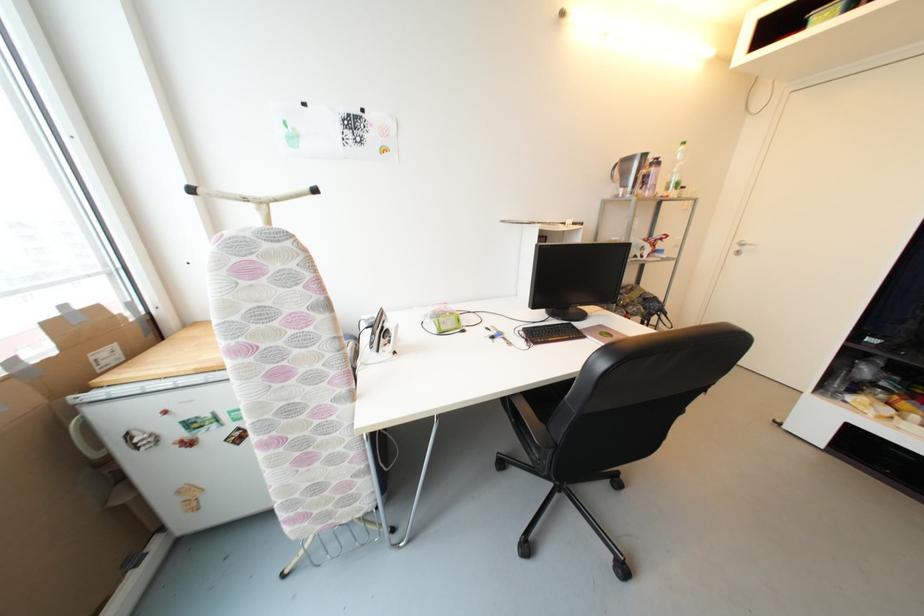
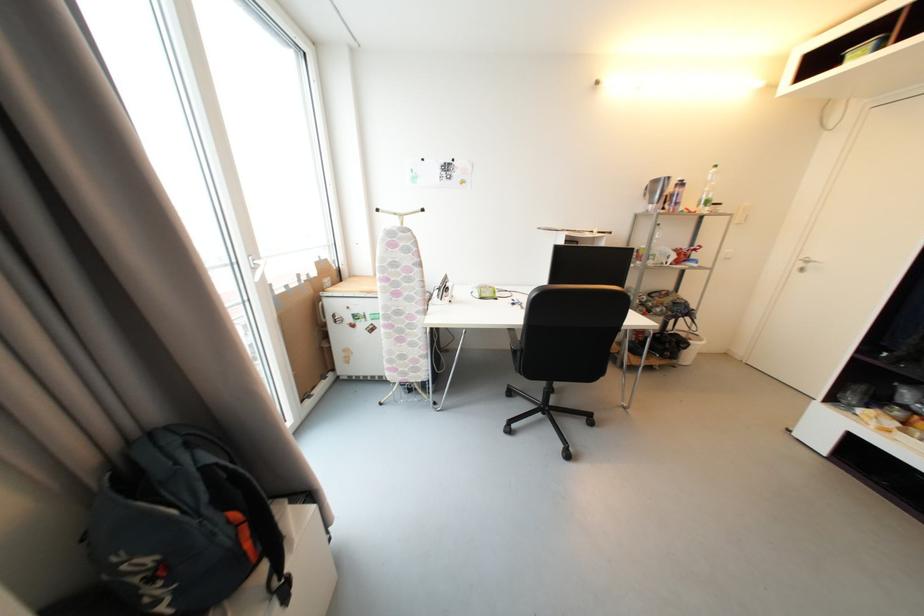
The point at (742, 249) is marked in the first image. Where is the corresponding point in the second image?

(806, 267)